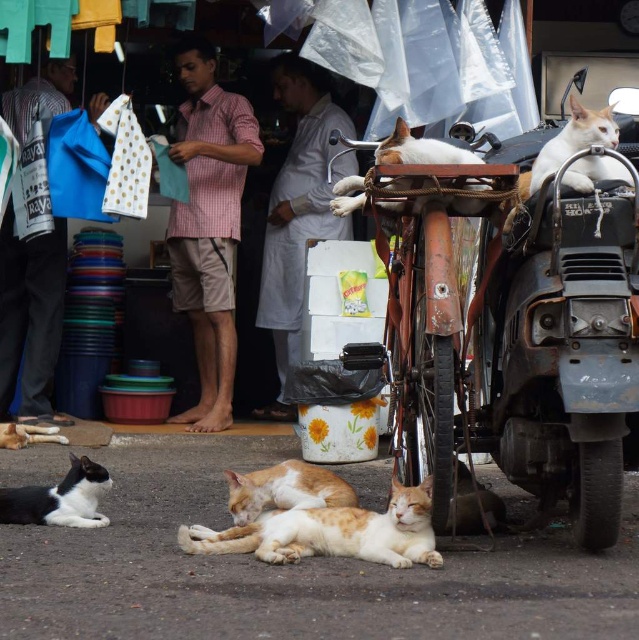
Question: Which of the following is the closest to the observer?

Choices:
 (A) (341, 204)
 (B) (0, 424)
 (C) (104, 522)
 (D) (339, 515)

Answer: (D)

Question: Which is farther from the white fur cat at center?

Choices:
 (A) white fur cat at lower left
 (B) black and white fur cat at lower left
 (C) orange tabby cat at center
 (D) orange fur cat at center

Answer: (A)

Question: From the image, what is the correct spatial relationship of orange fur cat at center in relation to white fur cat at center?

Choices:
 (A) below
 (B) above

Answer: (A)

Question: Which point appears closest to the camera in this image?

Choices:
 (A) (12, 440)
 (B) (399, 497)

Answer: (B)

Question: Does orange fur cat at center have a lesser width compared to white fur cat at lower left?

Choices:
 (A) yes
 (B) no

Answer: (B)

Question: Is black and white fur cat at lower left wider than white fur cat at lower left?

Choices:
 (A) yes
 (B) no

Answer: (A)